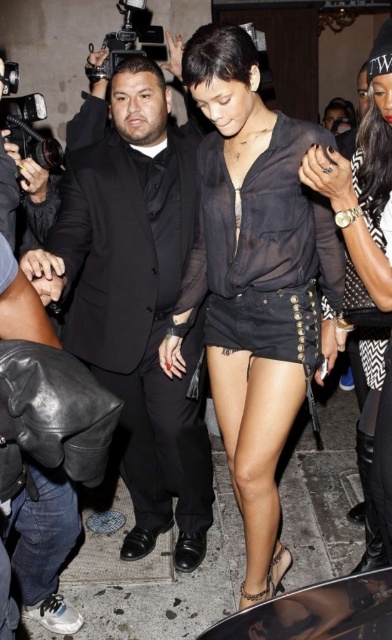
You are a photographer standing at a certain distance from the sheer black blouse at center. You want to capture a clear photo of it without any blur. Given that the minimum focusing distance for your camera is 5 feet, will you be able to take a clear photo?

The sheer black blouse at center and the viewer are 5.34 feet apart, which is beyond the camera minimum focusing distance of 5 feet. Therefore, you can take a clear photo without blur.

Based on the scene description, which clothing item is positioned lower on the woman, the sheer black blouse at center or the sheer black dress at center?

The sheer black blouse at center is located below the sheer black dress at center, so the sheer black blouse at center is positioned lower on the woman.

You are a photographer at a formal event. You need to capture a photo of the sheer black dress at center and the black sheer blouse at center. Which one is shorter in height?

The sheer black dress at center has a lesser height compared to the black sheer blouse at center, so the sheer black dress at center is shorter in height.